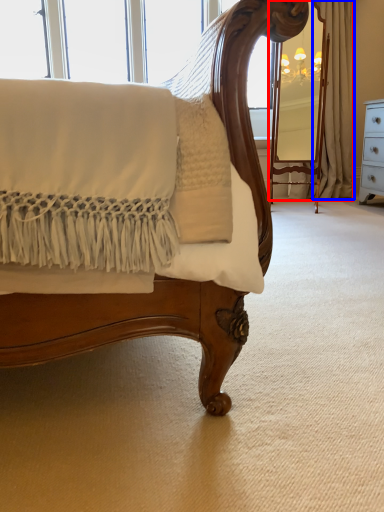
Question: Among these objects, which one is nearest to the camera, curtain (highlighted by a red box) or curtain (highlighted by a blue box)?

Choices:
 (A) curtain
 (B) curtain

Answer: (A)